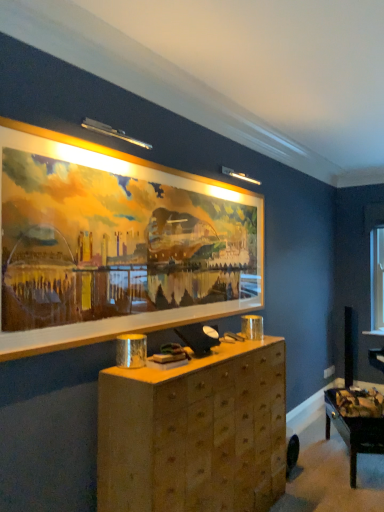
Question: From the image's perspective, is wooden picture frame at upper center above or below transparent glass window at upper right?

Choices:
 (A) above
 (B) below

Answer: (A)

Question: Considering the positions of wooden picture frame at upper center and transparent glass window at upper right in the image, is wooden picture frame at upper center wider or thinner than transparent glass window at upper right?

Choices:
 (A) thin
 (B) wide

Answer: (A)

Question: Based on their relative distances, which object is nearer to the wooden table at lower right?

Choices:
 (A) wooden chest of drawers at center
 (B) transparent glass window at upper right
 (C) wooden picture frame at upper center

Answer: (A)

Question: Estimate the real-world distances between objects in this image. Which object is farther from the wooden picture frame at upper center?

Choices:
 (A) wooden chest of drawers at center
 (B) wooden table at lower right
 (C) transparent glass window at upper right

Answer: (C)